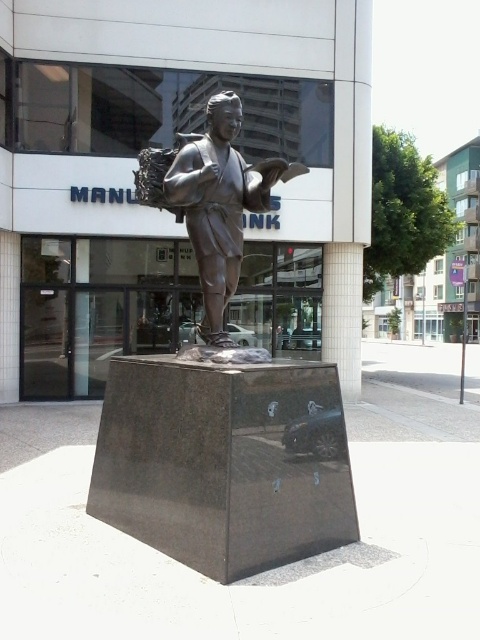
Does bronze statue at center appear under smooth gray pillar at center?

No, bronze statue at center is not below smooth gray pillar at center.

Is bronze statue at center wider than smooth gray pillar at center?

Indeed, bronze statue at center has a greater width compared to smooth gray pillar at center.

This screenshot has width=480, height=640. Describe the element at coordinates (212, 200) in the screenshot. I see `bronze statue at center` at that location.

The image size is (480, 640). Identify the location of bronze statue at center. (212, 200).